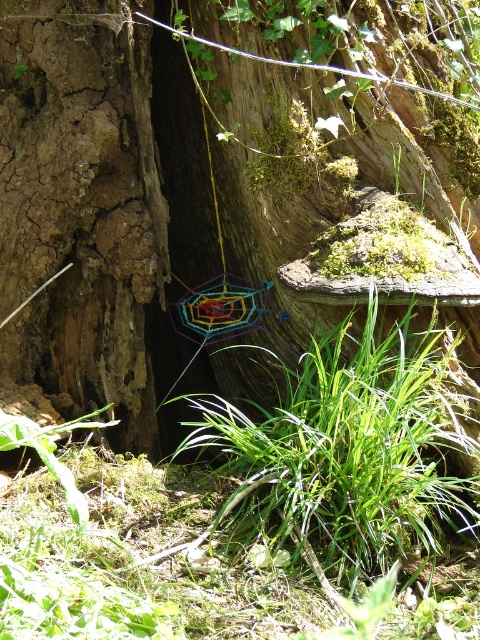
Can you confirm if wooden tree trunk at center is thinner than brown rough tree trunk at left?

No.

Between point (176, 83) and point (115, 250), which one is positioned behind?

Point (176, 83)

Identify the location of wooden tree trunk at center. (218, 186).

Can you confirm if brown rough tree trunk at left is shorter than green grass at center?

In fact, brown rough tree trunk at left may be taller than green grass at center.

Between brown rough tree trunk at left and green grass at center, which one has more height?

With more height is brown rough tree trunk at left.

Describe the element at coordinates (81, 205) in the screenshot. This screenshot has height=640, width=480. I see `brown rough tree trunk at left` at that location.

I want to click on brown rough tree trunk at left, so click(x=81, y=205).

Consider the image. Does wooden tree trunk at center have a smaller size compared to green grass at center?

No, wooden tree trunk at center is not smaller than green grass at center.

Who is more distant from viewer, (156, 387) or (321, 531)?

Point (156, 387)

I want to click on wooden tree trunk at center, so click(218, 186).